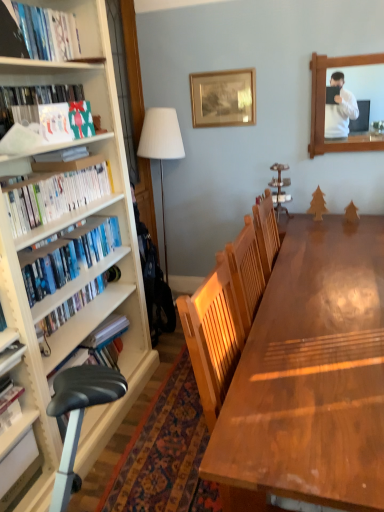
Question: Is hardcover book at upper left, marked as the first book in a top-to-bottom arrangement, in contact with hardcover book at left, which is the fifth book from top to bottom?

Choices:
 (A) no
 (B) yes

Answer: (A)

Question: From a real-world perspective, is hardcover book at upper left, the 5th book positioned from the bottom, positioned under hardcover book at left, which is counted as the 1th book, starting from the bottom, based on gravity?

Choices:
 (A) yes
 (B) no

Answer: (B)

Question: Is hardcover book at upper left, the 5th book positioned from the bottom, further to camera compared to hardcover book at left, which is counted as the 1th book, starting from the bottom?

Choices:
 (A) no
 (B) yes

Answer: (B)

Question: From the image's perspective, does hardcover book at upper left, the 5th book positioned from the bottom, appear higher than hardcover book at left, which is the fifth book from top to bottom?

Choices:
 (A) yes
 (B) no

Answer: (A)

Question: Considering the relative positions of hardcover book at upper left, marked as the first book in a top-to-bottom arrangement, and hardcover book at left, which is counted as the 1th book, starting from the bottom, in the image provided, is hardcover book at upper left, marked as the first book in a top-to-bottom arrangement, to the right of hardcover book at left, which is counted as the 1th book, starting from the bottom, from the viewer's perspective?

Choices:
 (A) yes
 (B) no

Answer: (A)

Question: Is hardcover book at upper left, the 5th book positioned from the bottom, outside of hardcover book at left, which is counted as the 1th book, starting from the bottom?

Choices:
 (A) no
 (B) yes

Answer: (B)

Question: Is matte green gift bag at left, which ranks as the fourth book in bottom-to-top order, directly adjacent to wooden picture frame at upper center?

Choices:
 (A) yes
 (B) no

Answer: (B)

Question: Is matte green gift bag at left, which ranks as the fourth book in bottom-to-top order, to the right of wooden picture frame at upper center from the viewer's perspective?

Choices:
 (A) yes
 (B) no

Answer: (B)

Question: From the image's perspective, is matte green gift bag at left, the second book in the top-to-bottom sequence, located beneath wooden picture frame at upper center?

Choices:
 (A) yes
 (B) no

Answer: (A)

Question: From the image's perspective, is matte green gift bag at left, which ranks as the fourth book in bottom-to-top order, on wooden picture frame at upper center?

Choices:
 (A) no
 (B) yes

Answer: (A)

Question: Considering the relative sizes of matte green gift bag at left, which ranks as the fourth book in bottom-to-top order, and wooden picture frame at upper center in the image provided, is matte green gift bag at left, which ranks as the fourth book in bottom-to-top order, wider than wooden picture frame at upper center?

Choices:
 (A) no
 (B) yes

Answer: (B)

Question: Considering the relative sizes of matte green gift bag at left, the second book in the top-to-bottom sequence, and wooden picture frame at upper center in the image provided, is matte green gift bag at left, the second book in the top-to-bottom sequence, bigger than wooden picture frame at upper center?

Choices:
 (A) no
 (B) yes

Answer: (B)

Question: Is wooden frame at upper right to the right of white glossy bookshelf at left, the 3th book positioned from the top, from the viewer's perspective?

Choices:
 (A) yes
 (B) no

Answer: (A)